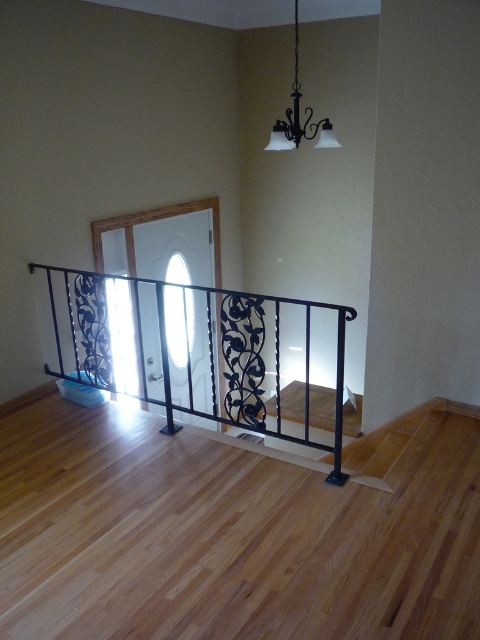
Question: Does black wrought iron railing at center come in front of black matte chandelier at upper center?

Choices:
 (A) yes
 (B) no

Answer: (A)

Question: Is black wrought iron railing at center to the left of black matte chandelier at upper center from the viewer's perspective?

Choices:
 (A) no
 (B) yes

Answer: (B)

Question: Which point is farther to the camera?

Choices:
 (A) black wrought iron railing at center
 (B) black matte chandelier at upper center

Answer: (B)

Question: From the image, what is the correct spatial relationship of black wrought iron railing at center in relation to black matte chandelier at upper center?

Choices:
 (A) left
 (B) right

Answer: (A)